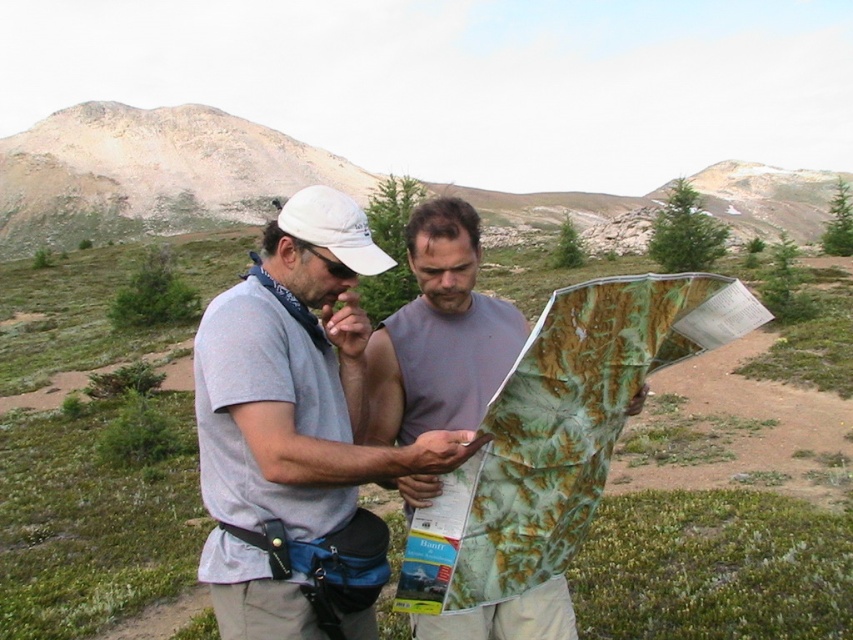
Is green textured map at center further to camera compared to rugged brown mountain at upper center?

No.

Does point (492, 458) come farther from viewer compared to point (607, 216)?

No, it is not.

Identify the location of green textured map at center. The width and height of the screenshot is (853, 640). (558, 433).

Who is shorter, matte gray shirt at center or rugged brown mountain at upper center?

matte gray shirt at center is shorter.

Is matte gray shirt at center wider than rugged brown mountain at upper center?

No, matte gray shirt at center is not wider than rugged brown mountain at upper center.

Is point (381, 337) closer to viewer compared to point (119, 224)?

That is True.

At what (x,y) coordinates should I click in order to perform the action: click on matte gray shirt at center. Please return your answer as a coordinate pair (x, y). The image size is (853, 640). Looking at the image, I should click on (403, 374).

Does green textured map at center have a lesser width compared to matte gray shirt at center?

Yes.

Which is more to the left, green textured map at center or matte gray shirt at center?

From the viewer's perspective, matte gray shirt at center appears more on the left side.

Describe the element at coordinates (558, 433) in the screenshot. I see `green textured map at center` at that location.

Identify the location of green textured map at center. The height and width of the screenshot is (640, 853). (558, 433).